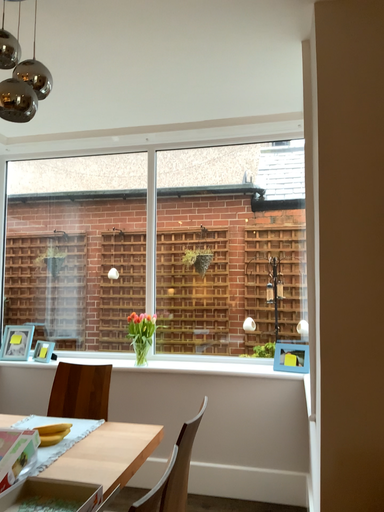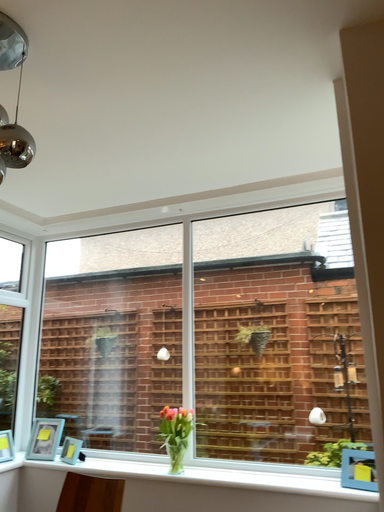
Question: How did the camera likely rotate when shooting the video?

Choices:
 (A) rotated left
 (B) rotated right

Answer: (A)